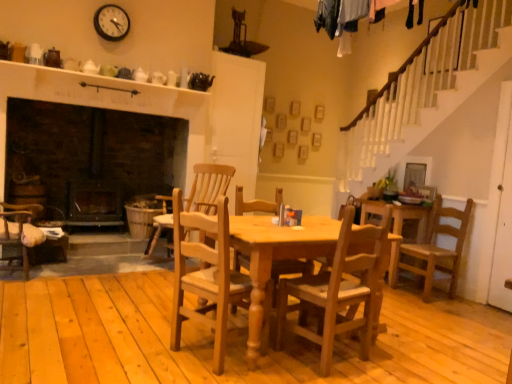
Locate an element on the screen. Image resolution: width=512 pixels, height=384 pixels. free spot in front of light brown wood chair at center, acting as the fourth chair starting from the front is located at coordinates (140, 282).